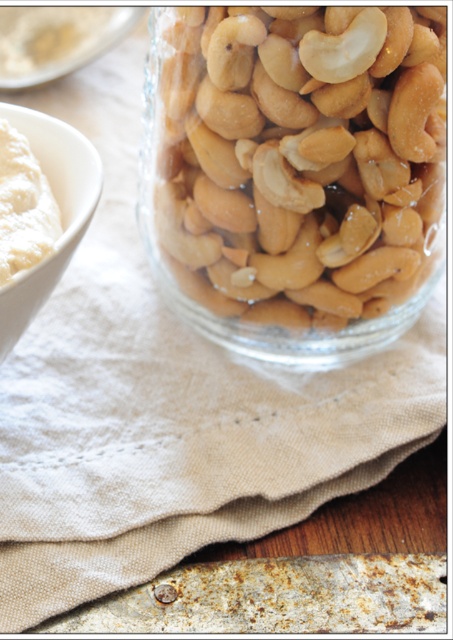
Can you confirm if white matte bowl at left is smaller than white creamy spread at left?

Actually, white matte bowl at left might be larger than white creamy spread at left.

Between white matte bowl at left and white creamy spread at left, which one is positioned lower?

white creamy spread at left is below.

What do you see at coordinates (58, 208) in the screenshot? I see `white matte bowl at left` at bounding box center [58, 208].

At what (x,y) coordinates should I click in order to perform the action: click on white matte bowl at left. Please return your answer as a coordinate pair (x, y). Looking at the image, I should click on (58, 208).

Is shiny beige cashews at center further to camera compared to white matte bowl at left?

Yes, shiny beige cashews at center is behind white matte bowl at left.

Based on the photo, which of these two, shiny beige cashews at center or white matte bowl at left, stands shorter?

With less height is white matte bowl at left.

What do you see at coordinates (303, 157) in the screenshot?
I see `shiny beige cashews at center` at bounding box center [303, 157].

You are a GUI agent. You are given a task and a screenshot of the screen. Output one action in this format:
    pyautogui.click(x=<x>, y=<y>)
    Task: Click on the shiny beige cashews at center
    
    Given the screenshot: What is the action you would take?
    [303, 157]

Does shiny beige cashews at center lie behind white creamy spread at left?

Yes.

The height and width of the screenshot is (640, 453). What do you see at coordinates (303, 157) in the screenshot? I see `shiny beige cashews at center` at bounding box center [303, 157].

Is point (244, 157) closer to camera compared to point (13, 218)?

That is False.

The height and width of the screenshot is (640, 453). Find the location of `shiny beige cashews at center`. shiny beige cashews at center is located at coordinates (303, 157).